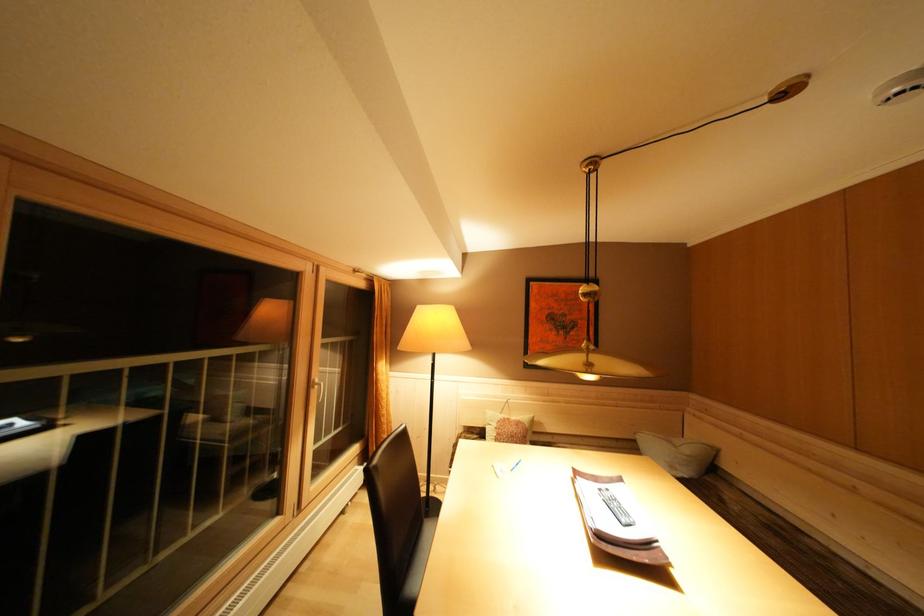
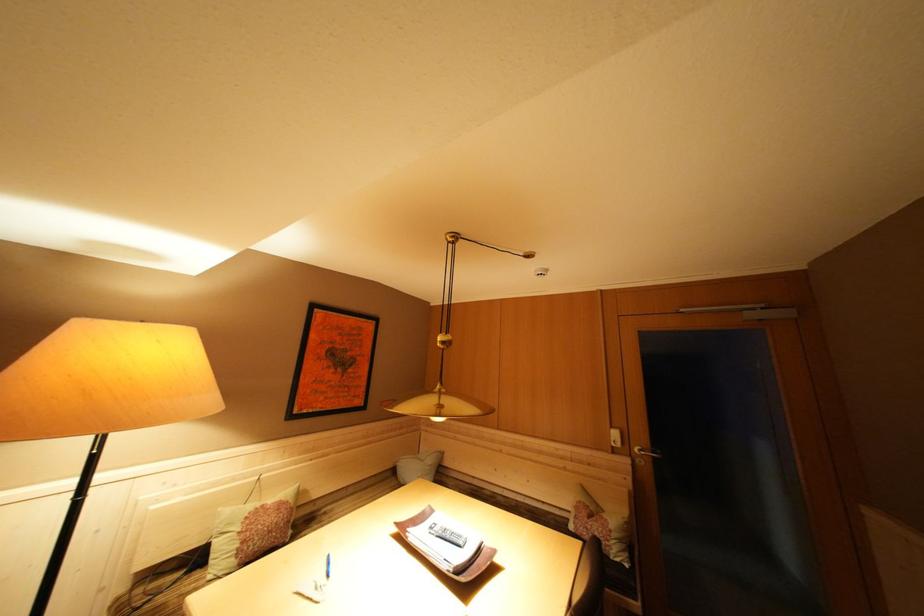
Question: The camera is either moving clockwise (left) or counter-clockwise (right) around the object. The first image is from the beginning of the video and the second image is from the end. Is the camera moving left or right when shooting the video?

Choices:
 (A) Left
 (B) Right

Answer: (A)